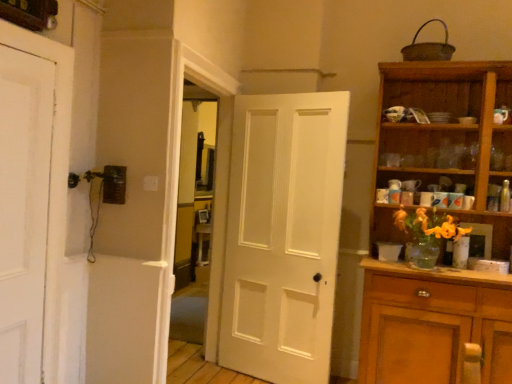
Describe the element at coordinates (283, 235) in the screenshot. I see `white matte door at center, which is counted as the 2th door, starting from the front` at that location.

In order to face wooden cabinet at right, should I rotate leftwards or rightwards?

You should rotate right by 23.843 degrees.

Measure the distance between point (41, 140) and camera.

Point (41, 140) and camera are 2.17 meters apart.

Where is `white matte door at center, which is counted as the 2th door, starting from the front`? This screenshot has width=512, height=384. white matte door at center, which is counted as the 2th door, starting from the front is located at coordinates (283, 235).

Is white matte door at center, the 1th door when ordered from back to front, shorter than wooden cabinet at right?

Correct, white matte door at center, the 1th door when ordered from back to front, is not as tall as wooden cabinet at right.

In the scene shown: Is white matte door at center, which is counted as the second door, starting from the left, not inside wooden cabinet at right?

Indeed, white matte door at center, which is counted as the second door, starting from the left, is completely outside wooden cabinet at right.

Are white matte door at center, which is counted as the 2th door, starting from the front, and wooden cabinet at right beside each other?

No, white matte door at center, which is counted as the 2th door, starting from the front, is not beside wooden cabinet at right.

From the image's perspective, which one is positioned lower, white matte door at left, the second door positioned from the back, or white matte door at center, which is the 1th door in right-to-left order?

white matte door at center, which is the 1th door in right-to-left order.

Who is bigger, white matte door at left, acting as the first door starting from the left, or white matte door at center, the 1th door when ordered from back to front?

With larger size is white matte door at center, the 1th door when ordered from back to front.

Would you say white matte door at left, the 1th door positioned from the front, is a long distance from white matte door at center, which is counted as the second door, starting from the left?

Yes.

Looking at this image, can you tell me how much white matte door at left, which is counted as the 2th door, starting from the right, and white matte door at center, which is counted as the second door, starting from the left, differ in facing direction?

There is a 101-degree angle between the facing directions of white matte door at left, which is counted as the 2th door, starting from the right, and white matte door at center, which is counted as the second door, starting from the left.

From the image's perspective, between wooden cabinet at right and white matte door at left, the second door positioned from the back, who is located below?

wooden cabinet at right is shown below in the image.

Does wooden cabinet at right lie in front of white matte door at left, acting as the first door starting from the left?

No, wooden cabinet at right is further to the viewer.

Can you confirm if wooden cabinet at right is bigger than white matte door at left, which is counted as the 2th door, starting from the right?

Yes, wooden cabinet at right is bigger than white matte door at left, which is counted as the 2th door, starting from the right.

Is point (468, 322) farther from viewer compared to point (49, 150)?

Yes, point (468, 322) is behind point (49, 150).

Does wooden cabinet at right have a greater height compared to white matte door at center, which is the 1th door in right-to-left order?

Yes, wooden cabinet at right is taller than white matte door at center, which is the 1th door in right-to-left order.

Who is bigger, wooden cabinet at right or white matte door at center, the 1th door when ordered from back to front?

wooden cabinet at right.

Is wooden cabinet at right inside or outside of white matte door at center, which is counted as the second door, starting from the left?

wooden cabinet at right is not enclosed by white matte door at center, which is counted as the second door, starting from the left.

From a real-world perspective, who is located lower, wooden cabinet at right or white matte door at center, which is the 1th door in right-to-left order?

In real-world perspective, white matte door at center, which is the 1th door in right-to-left order, is lower.

At what (x,y) coordinates should I click in order to perform the action: click on door in front of the wooden cabinet at right. Please return your answer as a coordinate pair (x, y). Looking at the image, I should click on (24, 209).

Which object is further away from the camera, white matte door at left, acting as the first door starting from the left, or wooden cabinet at right?

wooden cabinet at right.

Can you confirm if white matte door at left, acting as the first door starting from the left, is bigger than wooden cabinet at right?

No, white matte door at left, acting as the first door starting from the left, is not bigger than wooden cabinet at right.

Is white matte door at center, which is counted as the second door, starting from the left, with white matte door at left, which is counted as the 2th door, starting from the right?

No, white matte door at center, which is counted as the second door, starting from the left, is not making contact with white matte door at left, which is counted as the 2th door, starting from the right.

Is white matte door at center, which is counted as the second door, starting from the left, closer to camera compared to white matte door at left, which is counted as the 2th door, starting from the right?

No.

Who is bigger, white matte door at center, which is the 1th door in right-to-left order, or white matte door at left, the second door positioned from the back?

white matte door at center, which is the 1th door in right-to-left order, is bigger.

Is white matte door at center, which is the 1th door in right-to-left order, not inside white matte door at left, the second door positioned from the back?

Yes, white matte door at center, which is the 1th door in right-to-left order, is outside of white matte door at left, the second door positioned from the back.

Locate an element on the screen. The width and height of the screenshot is (512, 384). cupboard in front of the white matte door at center, which is counted as the 2th door, starting from the front is located at coordinates (439, 213).

The width and height of the screenshot is (512, 384). In order to click on door directly beneath the white matte door at left, which is counted as the 2th door, starting from the right (from a real-world perspective) in this screenshot , I will do `click(283, 235)`.

Considering their positions, is white matte door at center, which is the 1th door in right-to-left order, positioned further to wooden cabinet at right than white matte door at left, acting as the first door starting from the left?

The object further to wooden cabinet at right is white matte door at left, acting as the first door starting from the left.

Which object lies nearer to the anchor point white matte door at left, which is counted as the 2th door, starting from the right, white matte door at center, which is counted as the 2th door, starting from the front, or wooden cabinet at right?

white matte door at center, which is counted as the 2th door, starting from the front, is positioned closer to the anchor white matte door at left, which is counted as the 2th door, starting from the right.

Estimate the real-world distances between objects in this image. Which object is further from white matte door at center, which is counted as the second door, starting from the left, wooden cabinet at right or white matte door at left, the 1th door positioned from the front?

white matte door at left, the 1th door positioned from the front, is further to white matte door at center, which is counted as the second door, starting from the left.

Which object lies nearer to the anchor point white matte door at left, which is counted as the 2th door, starting from the right, wooden cabinet at right or white matte door at center, which is counted as the second door, starting from the left?

white matte door at center, which is counted as the second door, starting from the left, is closer to white matte door at left, which is counted as the 2th door, starting from the right.

When comparing their distances from white matte door at center, which is counted as the second door, starting from the left, does white matte door at left, the second door positioned from the back, or wooden cabinet at right seem closer?

wooden cabinet at right is positioned closer to the anchor white matte door at center, which is counted as the second door, starting from the left.

From the image, which object appears to be nearer to wooden cabinet at right, white matte door at left, which is counted as the 2th door, starting from the right, or white matte door at center, which is counted as the second door, starting from the left?

Based on the image, white matte door at center, which is counted as the second door, starting from the left, appears to be nearer to wooden cabinet at right.

The height and width of the screenshot is (384, 512). Find the location of `door between white matte door at left, which is counted as the 2th door, starting from the right, and wooden cabinet at right, in the horizontal direction`. door between white matte door at left, which is counted as the 2th door, starting from the right, and wooden cabinet at right, in the horizontal direction is located at coordinates (283, 235).